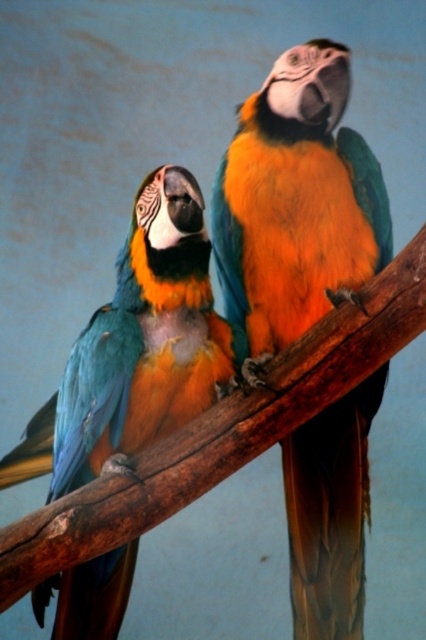
Between shiny orange parrot at center and shiny blue parrot at left, which one appears on the left side from the viewer's perspective?

Positioned to the left is shiny blue parrot at left.

Who is shorter, shiny orange parrot at center or shiny blue parrot at left?

shiny blue parrot at left is shorter.

Which is behind, point (359, 544) or point (201, 376)?

The point (359, 544) is behind.

Find the location of a particular element. This screenshot has height=640, width=426. shiny orange parrot at center is located at coordinates (296, 202).